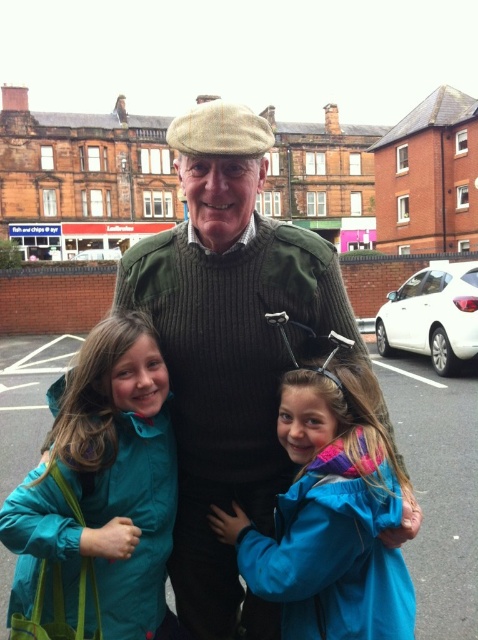
Is green wool sweater at center below blue fabric jacket at center?

No.

Which of these two, green wool sweater at center or blue fabric jacket at center, stands shorter?

blue fabric jacket at center

Where is `green wool sweater at center`? This screenshot has height=640, width=478. green wool sweater at center is located at coordinates (228, 349).

Where is `green wool sweater at center`? The image size is (478, 640). green wool sweater at center is located at coordinates (228, 349).

Which is behind, point (102, 390) or point (311, 392)?

The point (311, 392) is behind.

Does teal fabric jacket at lower left lie in front of blue fabric jacket at center?

Yes, teal fabric jacket at lower left is closer to the viewer.

The image size is (478, 640). I want to click on teal fabric jacket at lower left, so click(98, 499).

Image resolution: width=478 pixels, height=640 pixels. Identify the location of teal fabric jacket at lower left. (98, 499).

Describe the element at coordinates (228, 349) in the screenshot. Image resolution: width=478 pixels, height=640 pixels. I see `green wool sweater at center` at that location.

Consider the image. Measure the distance between point [319,248] and camera.

Point [319,248] and camera are 113.64 feet apart from each other.

The image size is (478, 640). I want to click on green wool sweater at center, so [228, 349].